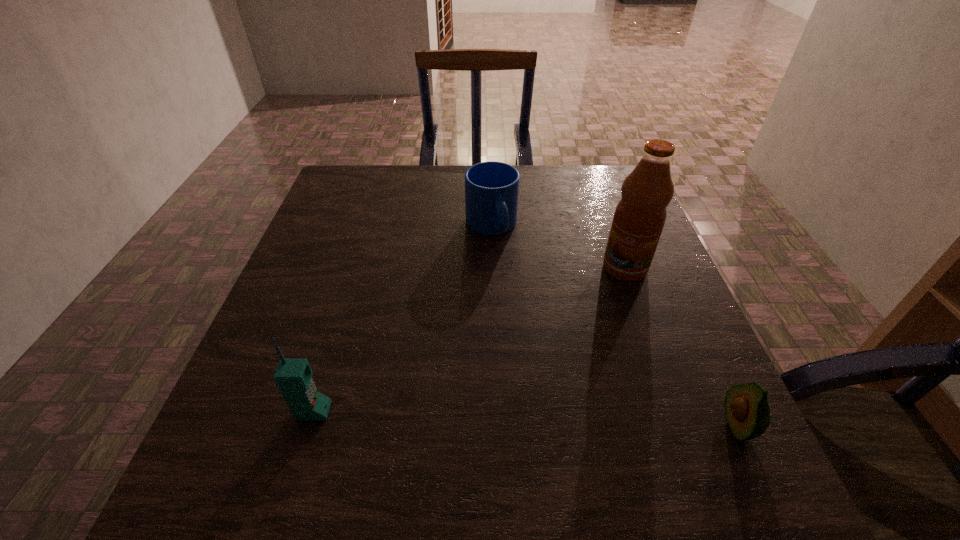
Where is `object that is the nearest to the mug`? object that is the nearest to the mug is located at coordinates (639, 218).

Identify which object is the second closest to the second object from left to right. Please provide its 2D coordinates. Your answer should be formatted as a tuple, i.e. [(x, y)], where the tuple contains the x and y coordinates of a point satisfying the conditions above.

[(293, 376)]

Find the location of a particular element. The height and width of the screenshot is (540, 960). free region that satisfies the following two spatial constraints: 1. on the front side of the avocado; 2. on the cut side of the second object from left to right is located at coordinates (497, 426).